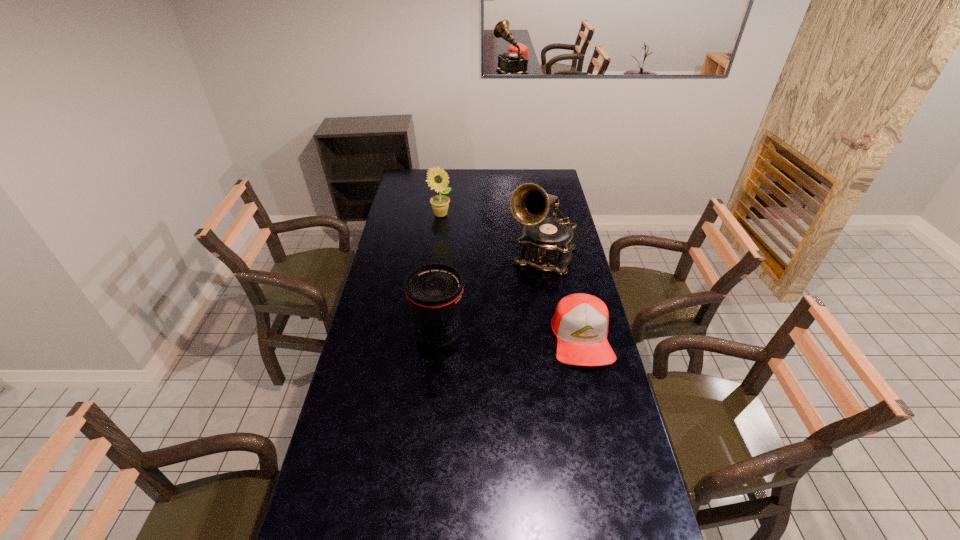
Where is `vacant space on the desktop that is between the telephoto lens and the baseball cap and is positioned on the horn of the tallest object`? vacant space on the desktop that is between the telephoto lens and the baseball cap and is positioned on the horn of the tallest object is located at coordinates (509, 337).

Locate an element on the screen. The width and height of the screenshot is (960, 540). free spot on the desktop that is between the telephoto lens and the baseball cap and is positioned on the face of the sunflower is located at coordinates (499, 337).